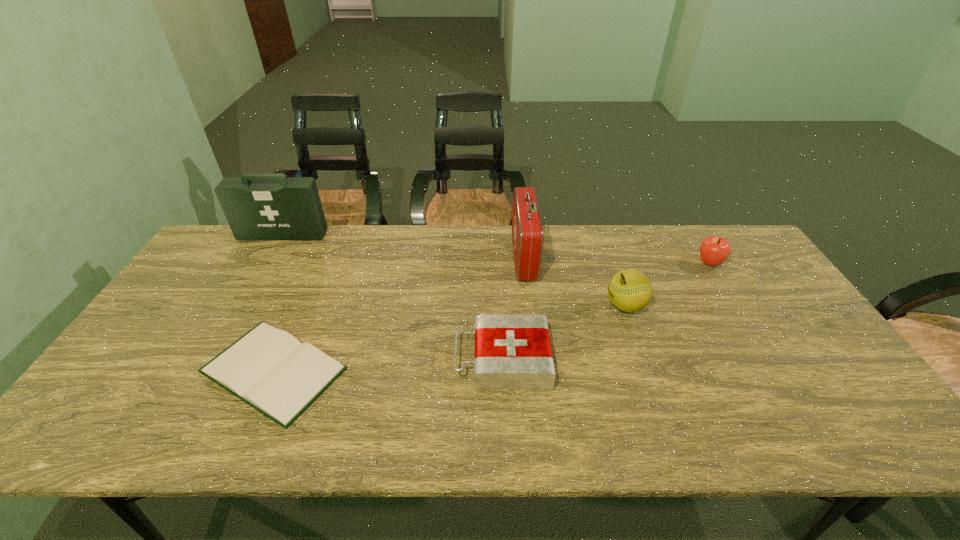
This screenshot has width=960, height=540. In order to click on free space between the nearest first-aid kit and the fourth farthest object in this screenshot , I will do `click(564, 332)`.

Locate an element on the screen. vacant point located between the softball and the apple is located at coordinates (667, 284).

Locate an element on the screen. This screenshot has width=960, height=540. blank region between the rightmost object and the second shortest object is located at coordinates (606, 311).

Image resolution: width=960 pixels, height=540 pixels. What are the coordinates of `the second closest object relative to the shortest first-aid kit` in the screenshot? It's located at (527, 231).

Locate which object is the third closest to the hardback book. Please provide its 2D coordinates. Your answer should be formatted as a tuple, i.e. [(x, y)], where the tuple contains the x and y coordinates of a point satisfying the conditions above.

[(527, 231)]

Identify which first-aid kit is located as the second nearest to the fifth object from left to right. Please provide its 2D coordinates. Your answer should be formatted as a tuple, i.e. [(x, y)], where the tuple contains the x and y coordinates of a point satisfying the conditions above.

[(512, 351)]

This screenshot has height=540, width=960. Identify the location of the first-aid kit that is the third closest to the fifth object from left to right. (258, 206).

The image size is (960, 540). I want to click on free point that satisfies the following two spatial constraints: 1. on the front-facing side of the leftmost first-aid kit; 2. on the right side of the apple, so click(x=267, y=263).

The height and width of the screenshot is (540, 960). Find the location of `free space that satisfies the following two spatial constraints: 1. on the front side of the shortest first-aid kit; 2. on the front side of the shortest object`. free space that satisfies the following two spatial constraints: 1. on the front side of the shortest first-aid kit; 2. on the front side of the shortest object is located at coordinates (503, 370).